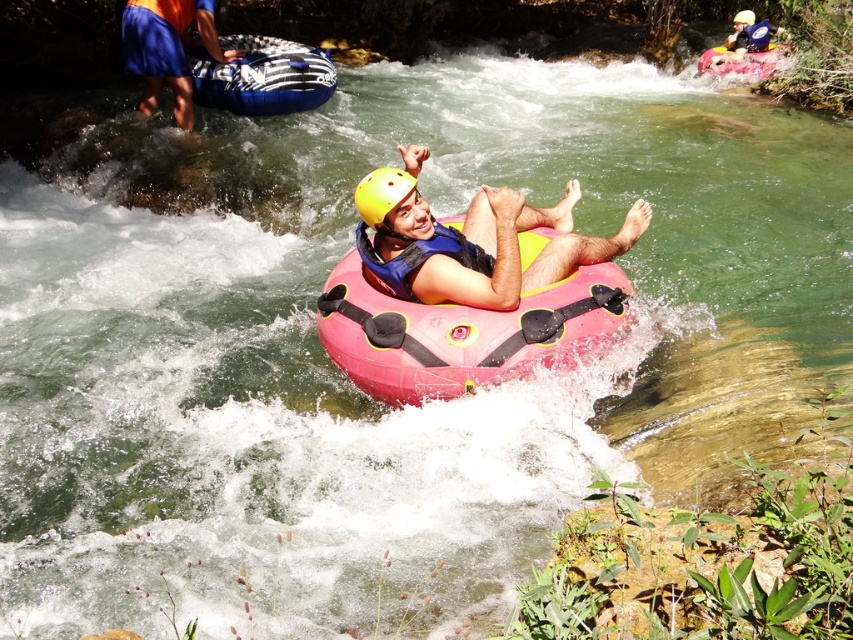
Is matte pink tube at center taller than yellow matte helmet at upper center?

Indeed, matte pink tube at center has a greater height compared to yellow matte helmet at upper center.

Who is taller, matte pink tube at center or yellow matte helmet at upper center?

matte pink tube at center

Identify the location of matte pink tube at center. The image size is (853, 640). (469, 241).

Does pink rubber raft at center have a lesser width compared to pink rubber raft at upper right?

Incorrect, pink rubber raft at center's width is not less than pink rubber raft at upper right's.

Is point (454, 326) positioned in front of point (757, 65)?

Yes, it is.

Measure the distance between pink rubber raft at center and camera.

4.16 meters

Identify the location of pink rubber raft at center. This screenshot has width=853, height=640. (460, 332).

Between point (303, 61) and point (730, 68), which one is positioned behind?

Point (730, 68)

Locate an element on the screen. The width and height of the screenshot is (853, 640). blue rubber raft at upper center is located at coordinates (262, 76).

What do you see at coordinates (262, 76) in the screenshot? I see `blue rubber raft at upper center` at bounding box center [262, 76].

The height and width of the screenshot is (640, 853). In order to click on blue rubber raft at upper center in this screenshot , I will do [262, 76].